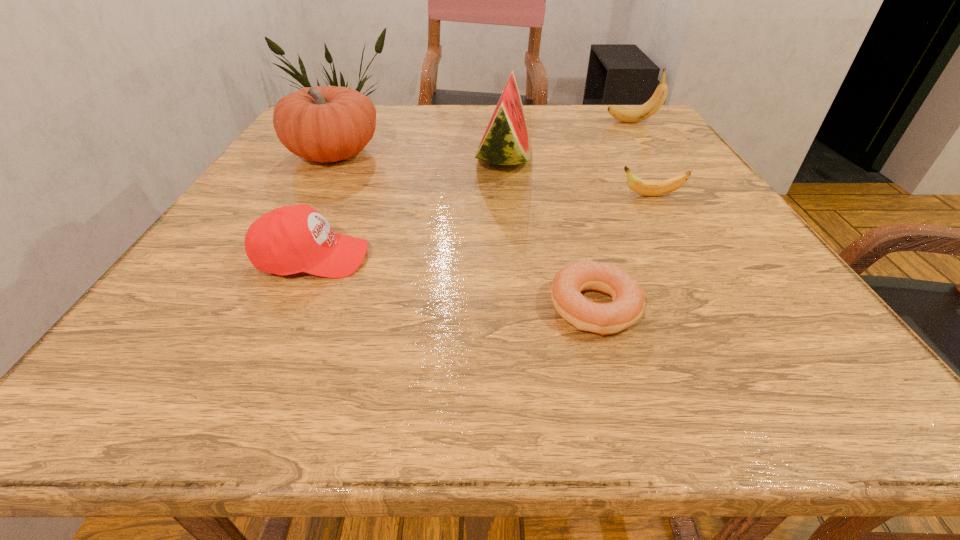
What are the coordinates of `watermelon situated at the far edge` in the screenshot? It's located at (506, 141).

At what (x,y) coordinates should I click in order to perform the action: click on pumpkin positioned at the far edge. Please return your answer as a coordinate pair (x, y). Image resolution: width=960 pixels, height=540 pixels. Looking at the image, I should click on (322, 124).

Locate an element on the screen. banana that is at the far edge is located at coordinates (629, 115).

Find the location of `pumpkin located at the left edge`. pumpkin located at the left edge is located at coordinates (322, 124).

Where is `baseball cap situated at the left edge`? Image resolution: width=960 pixels, height=540 pixels. baseball cap situated at the left edge is located at coordinates (291, 239).

Identify the location of object that is at the far left corner. Image resolution: width=960 pixels, height=540 pixels. (322, 124).

Find the location of a particular element. object that is at the far right corner is located at coordinates (629, 115).

Locate an element on the screen. This screenshot has width=960, height=540. vacant space at the far edge of the desktop is located at coordinates (418, 137).

This screenshot has height=540, width=960. What are the coordinates of `free space at the near edge` in the screenshot? It's located at (484, 396).

The image size is (960, 540). In the image, there is a desktop. In order to click on vacant space at the left edge in this screenshot , I will do [x=260, y=302].